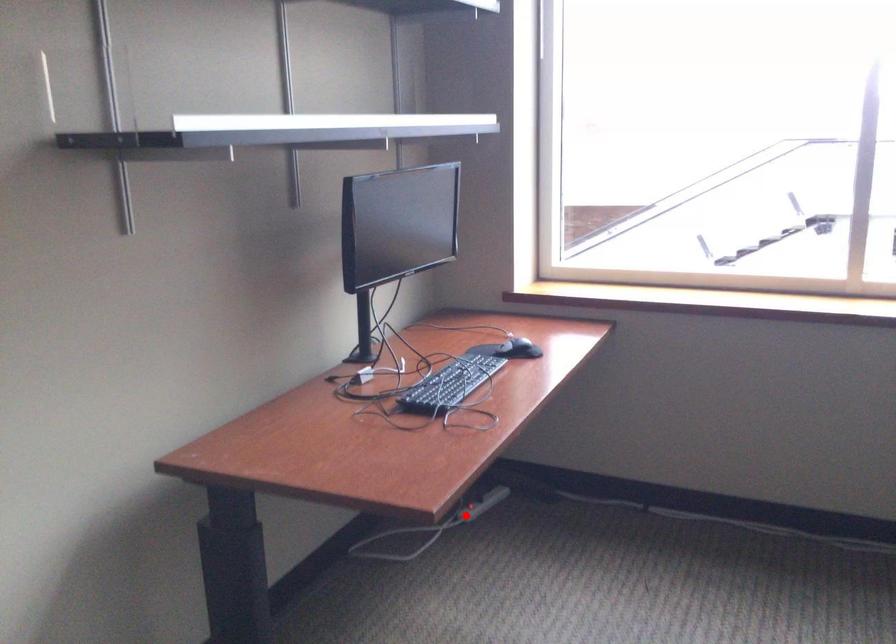
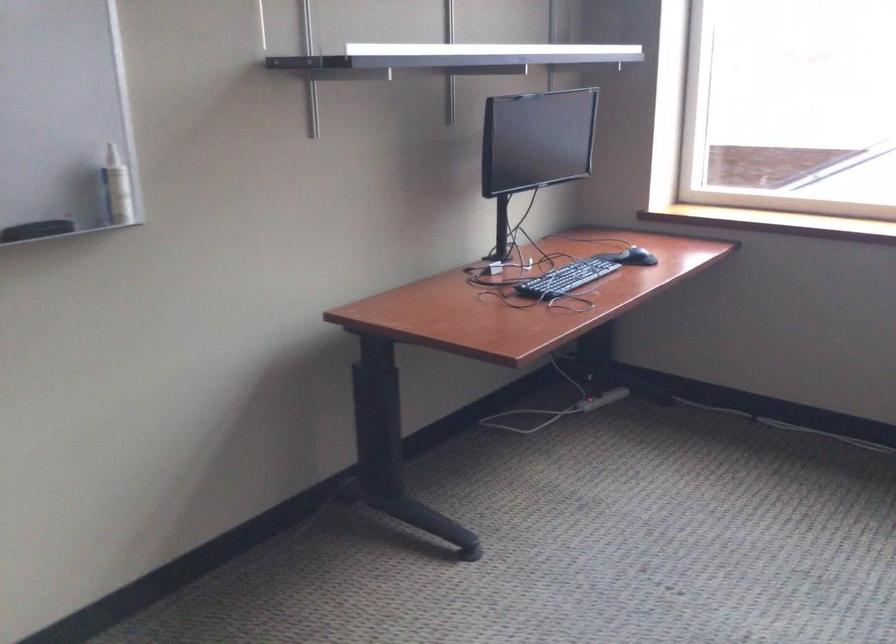
Question: I am providing you with two images of the same scene from different viewpoints. Image1 has a red point marked. In image2, the corresponding 3D location appears at what relative position? Reply with the corresponding letter.

Choices:
 (A) Closer
 (B) Farther

Answer: (B)